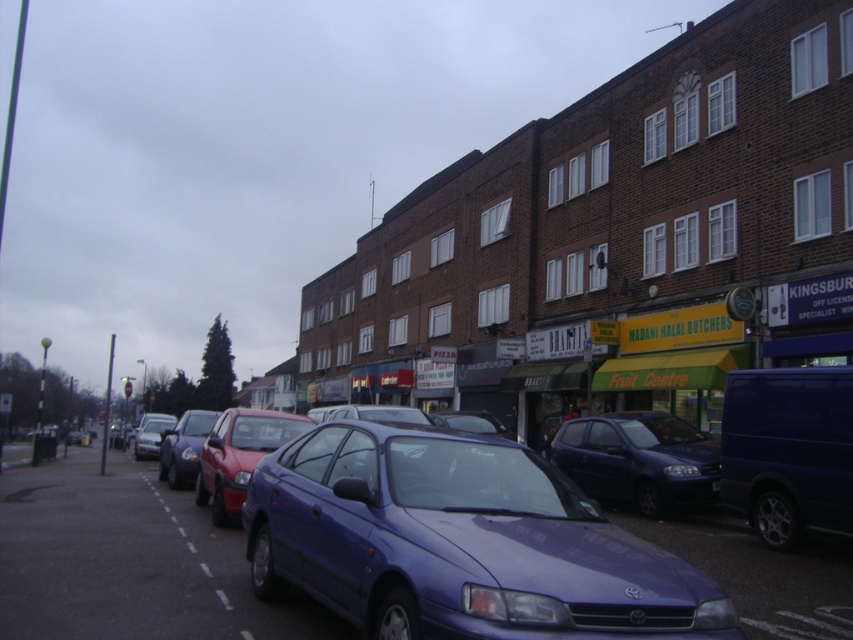
Does matte silver car at center come in front of black plastic license plate at center?

No, matte silver car at center is behind black plastic license plate at center.

Locate an element on the screen. Image resolution: width=853 pixels, height=640 pixels. matte silver car at center is located at coordinates (151, 435).

Between point (154, 448) and point (688, 467), which one is positioned behind?

Point (154, 448)

I want to click on matte silver car at center, so click(151, 435).

In the scene shown: Which of these two, shiny red car at center or metallic blue sedan at center, stands taller?

metallic blue sedan at center is taller.

Identify the location of shiny red car at center. Image resolution: width=853 pixels, height=640 pixels. (239, 456).

I want to click on shiny red car at center, so click(239, 456).

Does matte blue hatchback at center have a lesser width compared to metallic blue sedan at center?

Yes, matte blue hatchback at center is thinner than metallic blue sedan at center.

You are a GUI agent. You are given a task and a screenshot of the screen. Output one action in this format:
    pyautogui.click(x=<x>, y=<y>)
    Task: Click on the matte blue hatchback at center
    
    Given the screenshot: What is the action you would take?
    pyautogui.click(x=637, y=460)